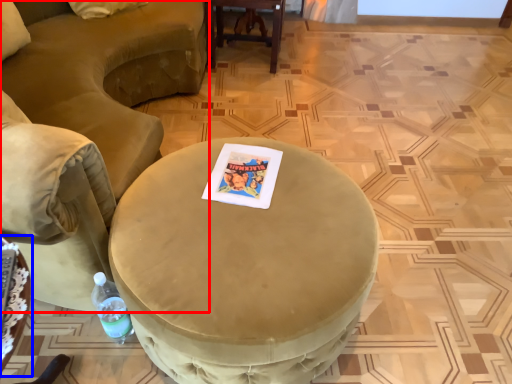
Question: Which object is closer to the camera taking this photo, chair (highlighted by a red box) or table (highlighted by a blue box)?

Choices:
 (A) chair
 (B) table

Answer: (A)